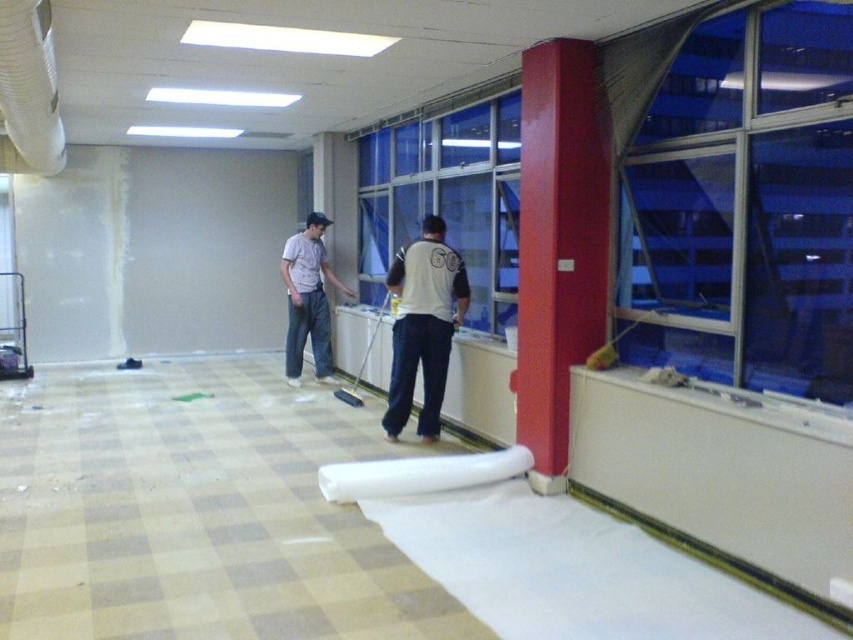
You are a painter who needs to decide whether to place a 1.2 meter wide canvas between the transparent glass window at upper right and the white matte shirt at center. Can the canvas fit between them based on their sizes?

The transparent glass window at upper right is larger than the white matte shirt at center. Since the canvas is 1.2 meters wide, but the exact distance between them isn not specified, we cannot determine if it will fit solely based on their sizes.

You are a painter standing in the room. You need to determine which window you can see more clearly. Which window is closer to you, the transparent glass window at upper right or the blue glass window at center?

The transparent glass window at upper right is in front of the blue glass window at center, so it is closer and therefore more clearly visible.

You are a painter who needs to decide whether to hang a 1.2 meter tall painting. You see the transparent glass window at upper right and the white matte shirt at center. Which object can the painting fit vertically without exceeding its height?

The transparent glass window at upper right is much taller than the white matte shirt at center. Since the painting is 1.2 meters tall, it can fit vertically on the transparent glass window at upper right but not on the white matte shirt at center.